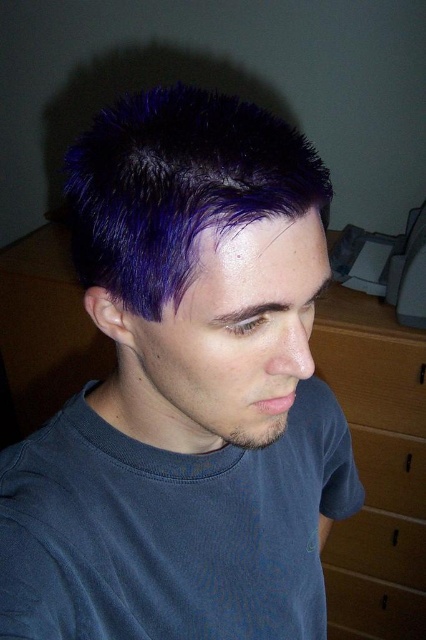
Question: Does purple matte hair at center have a lesser width compared to wooden drawer at lower right?

Choices:
 (A) yes
 (B) no

Answer: (B)

Question: Which point appears farthest from the camera in this image?

Choices:
 (A) (348, 333)
 (B) (203, 332)

Answer: (A)

Question: Among these objects, which one is nearest to the camera?

Choices:
 (A) brown wood dresser at right
 (B) purple spiky hair at upper center
 (C) wooden drawer at lower right
 (D) dark blue cotton t-shirt at lower center

Answer: (B)

Question: Is the position of purple matte hair at center more distant than that of wooden drawer at lower right?

Choices:
 (A) yes
 (B) no

Answer: (B)

Question: Which of these objects is positioned closest to the dark blue cotton t-shirt at lower center?

Choices:
 (A) purple matte hair at center
 (B) brown wood dresser at right

Answer: (A)

Question: Does purple matte hair at center appear on the right side of brown wood dresser at right?

Choices:
 (A) yes
 (B) no

Answer: (B)